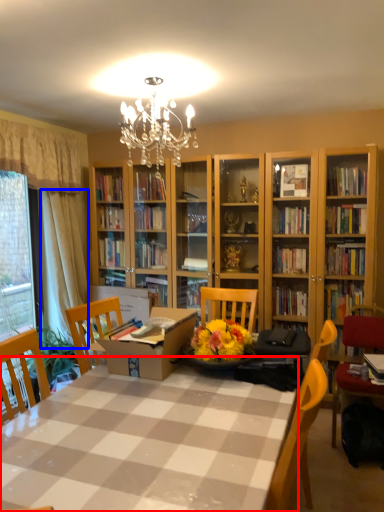
Question: Which of the following is the farthest to the observer, table (highlighted by a red box) or curtain (highlighted by a blue box)?

Choices:
 (A) table
 (B) curtain

Answer: (B)